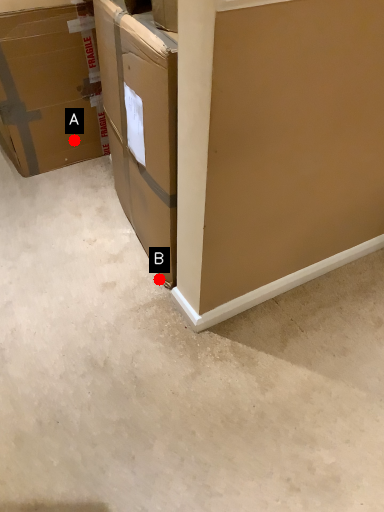
Question: Two points are circled on the image, labeled by A and B beside each circle. Which point is closer to the camera?

Choices:
 (A) A is closer
 (B) B is closer

Answer: (B)